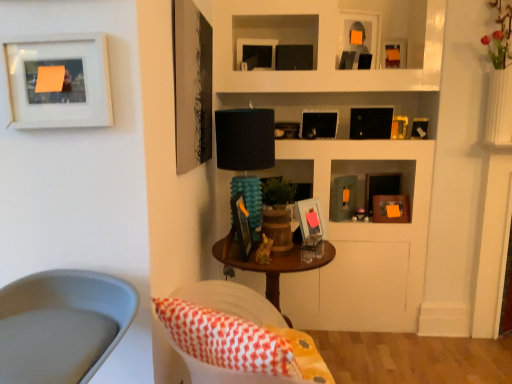
Question: Is matte white picture frame at upper left, acting as the 11th picture frame starting from the back, with smooth gray swivel chair at lower left?

Choices:
 (A) yes
 (B) no

Answer: (B)

Question: Is matte white picture frame at upper left, the first picture frame from the front, bigger than smooth gray swivel chair at lower left?

Choices:
 (A) yes
 (B) no

Answer: (B)

Question: From the image's perspective, is matte white picture frame at upper left, the first picture frame from the front, below smooth gray swivel chair at lower left?

Choices:
 (A) yes
 (B) no

Answer: (B)

Question: From a real-world perspective, is matte white picture frame at upper left, acting as the 11th picture frame starting from the back, located beneath smooth gray swivel chair at lower left?

Choices:
 (A) yes
 (B) no

Answer: (B)

Question: Can you confirm if matte white picture frame at upper left, the first picture frame from the front, is wider than smooth gray swivel chair at lower left?

Choices:
 (A) yes
 (B) no

Answer: (B)

Question: Is point (330, 380) closer or farther from the camera than point (398, 41)?

Choices:
 (A) closer
 (B) farther

Answer: (A)

Question: Looking at their shapes, would you say white fabric chair at lower left is wider or thinner than matte black picture frame at upper center, the tenth picture frame when ordered from front to back?

Choices:
 (A) thin
 (B) wide

Answer: (B)

Question: Considering the positions of white fabric chair at lower left and matte black picture frame at upper center, the tenth picture frame when ordered from front to back, in the image, is white fabric chair at lower left taller or shorter than matte black picture frame at upper center, the tenth picture frame when ordered from front to back,?

Choices:
 (A) tall
 (B) short

Answer: (A)

Question: Do you think white fabric chair at lower left is within matte black picture frame at upper center, the second picture frame from the back, or outside of it?

Choices:
 (A) inside
 (B) outside

Answer: (B)

Question: Looking at the image, does white fabric chair at lower left seem bigger or smaller compared to matte black picture frame at center, the 1th picture frame from the back?

Choices:
 (A) big
 (B) small

Answer: (A)

Question: Considering the positions of point (212, 279) and point (365, 188), is point (212, 279) closer or farther from the camera than point (365, 188)?

Choices:
 (A) farther
 (B) closer

Answer: (B)

Question: Is white fabric chair at lower left taller or shorter than matte black picture frame at center, which ranks as the eleventh picture frame in front-to-back order?

Choices:
 (A) short
 (B) tall

Answer: (B)

Question: From a real-world perspective, is white fabric chair at lower left physically located above or below matte black picture frame at center, the 1th picture frame from the back?

Choices:
 (A) below
 (B) above

Answer: (A)

Question: Looking at their shapes, would you say matte black picture frame at upper center, which is counted as the 4th picture frame, starting from the front, is wider or thinner than matte black picture frame at center, acting as the tenth picture frame starting from the back?

Choices:
 (A) thin
 (B) wide

Answer: (B)

Question: Considering their positions, is matte black picture frame at upper center, acting as the 8th picture frame starting from the back, located in front of or behind matte black picture frame at center, acting as the tenth picture frame starting from the back?

Choices:
 (A) behind
 (B) front

Answer: (A)